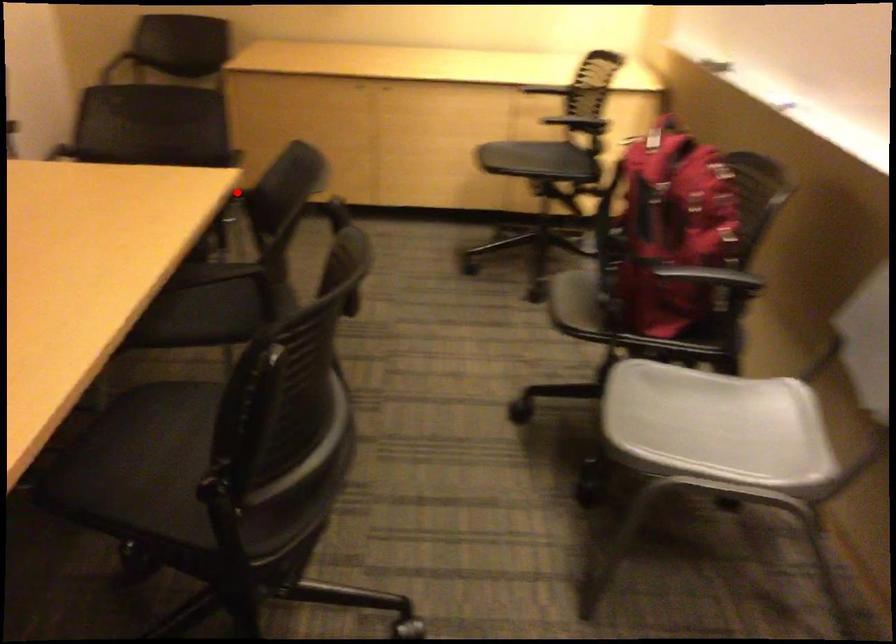
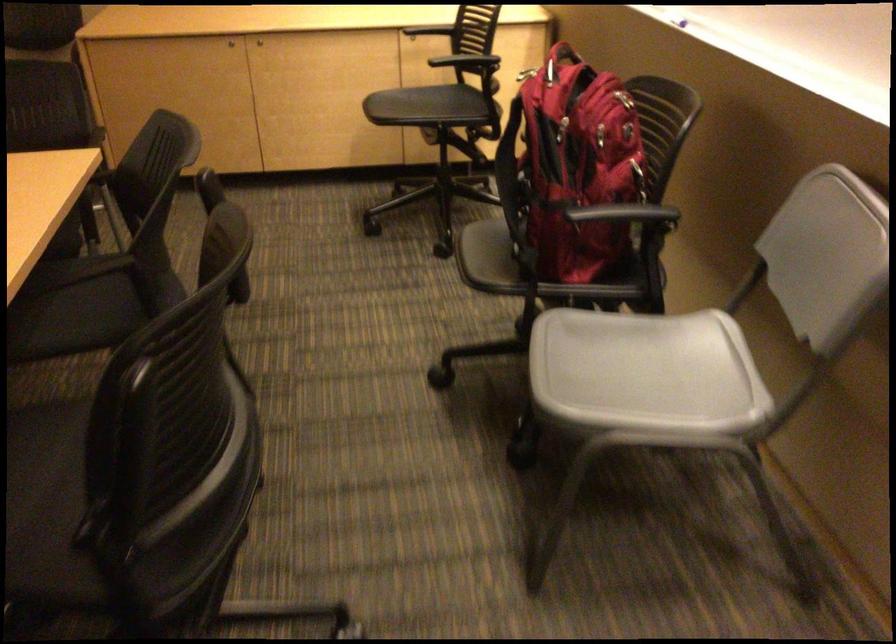
Question: I am providing you with two images of the same scene from different viewpoints. A red point is shown in image1. For the corresponding object point in image2, is it positioned nearer or farther from the camera?

Choices:
 (A) Nearer
 (B) Farther

Answer: (A)